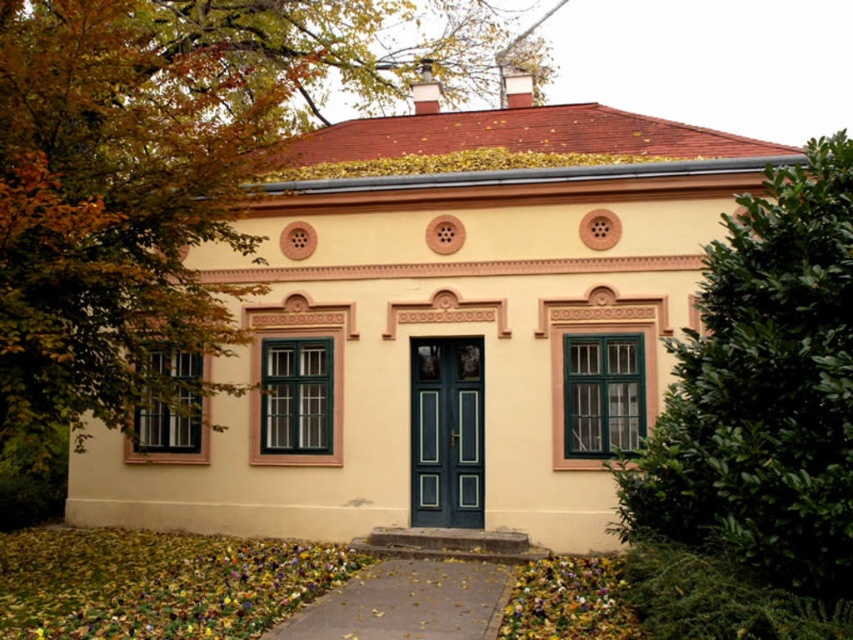
Is green leafy tree at left bigger than teal glossy door at center?

Yes, green leafy tree at left is bigger than teal glossy door at center.

Describe the element at coordinates (138, 186) in the screenshot. I see `green leafy tree at left` at that location.

You are a GUI agent. You are given a task and a screenshot of the screen. Output one action in this format:
    pyautogui.click(x=<x>, y=<y>)
    Task: Click on the green leafy tree at left
    The width and height of the screenshot is (853, 640).
    Given the screenshot: What is the action you would take?
    pyautogui.click(x=138, y=186)

Identify the location of green leafy bush at right. (756, 420).

Does green leafy bush at right appear on the right side of teal glossy door at center?

Indeed, green leafy bush at right is positioned on the right side of teal glossy door at center.

Find the location of a particular element. This screenshot has height=640, width=853. green leafy bush at right is located at coordinates (756, 420).

Locate an element on the screen. This screenshot has width=853, height=640. green leafy bush at right is located at coordinates (756, 420).

Is green leafy tree at left above green leafy bush at right?

Indeed, green leafy tree at left is positioned over green leafy bush at right.

Is green leafy tree at left wider than green leafy bush at right?

Correct, the width of green leafy tree at left exceeds that of green leafy bush at right.

Where is `green leafy tree at left`? Image resolution: width=853 pixels, height=640 pixels. green leafy tree at left is located at coordinates (138, 186).

Where is `green leafy tree at left`? Image resolution: width=853 pixels, height=640 pixels. green leafy tree at left is located at coordinates pos(138,186).